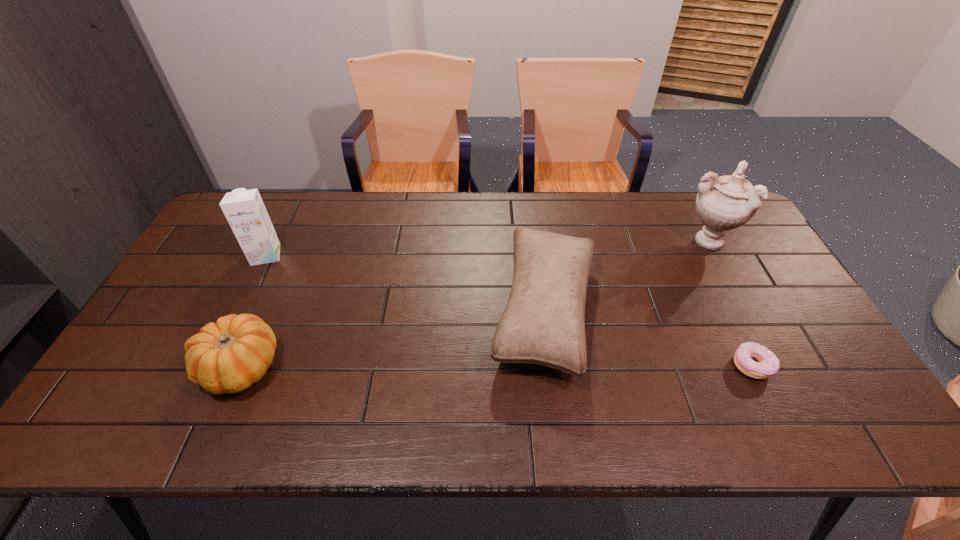
At what (x,y) coordinates should I click in order to perform the action: click on vacant region that satisfies the following two spatial constraints: 1. on the front side of the carton; 2. on the right side of the doughnut. Please return your answer as a coordinate pair (x, y). Looking at the image, I should click on (211, 366).

Locate an element on the screen. The width and height of the screenshot is (960, 540). free spot that satisfies the following two spatial constraints: 1. on the front side of the carton; 2. on the left side of the shortest object is located at coordinates (211, 366).